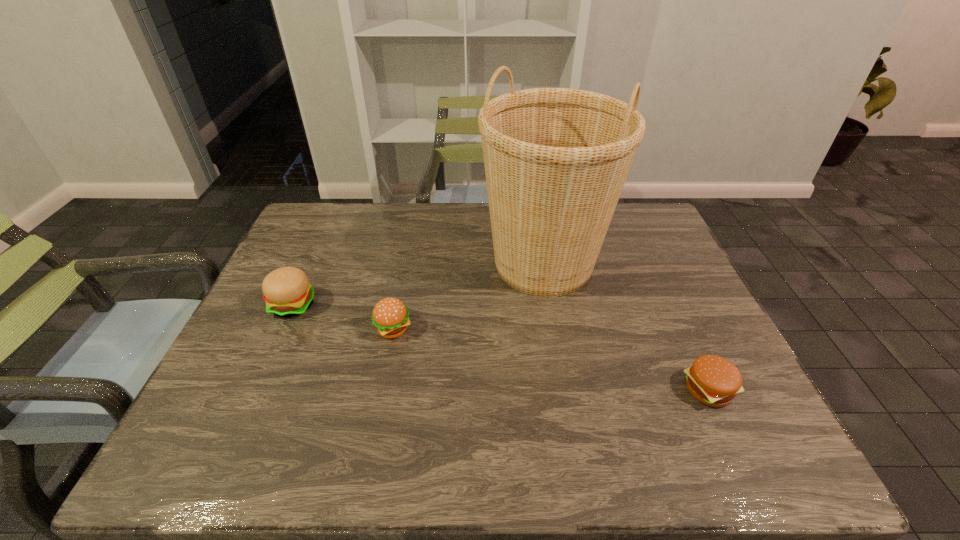
This screenshot has width=960, height=540. I want to click on basket, so click(x=556, y=159).

Where is `the third object from left to right`? the third object from left to right is located at coordinates (556, 159).

The width and height of the screenshot is (960, 540). Find the location of `the leftmost hamburger`. the leftmost hamburger is located at coordinates click(287, 292).

Where is `the second shortest object`? This screenshot has height=540, width=960. the second shortest object is located at coordinates (390, 316).

Image resolution: width=960 pixels, height=540 pixels. Find the location of `the second object from left to right`. the second object from left to right is located at coordinates (390, 316).

Find the location of a particular element. The height and width of the screenshot is (540, 960). the nearest object is located at coordinates (714, 381).

The height and width of the screenshot is (540, 960). I want to click on the nearest hamburger, so click(x=714, y=381).

This screenshot has height=540, width=960. In order to click on vacant space situated on the back of the basket in this screenshot , I will do `click(535, 214)`.

Image resolution: width=960 pixels, height=540 pixels. In order to click on free space located on the back of the leftmost hamburger in this screenshot , I will do `click(313, 262)`.

Locate an element on the screen. vacant space located on the right of the second tallest hamburger is located at coordinates (465, 329).